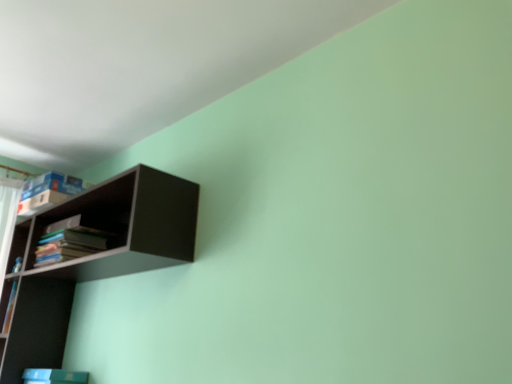
This screenshot has width=512, height=384. Describe the element at coordinates (69, 242) in the screenshot. I see `hardcover books at left` at that location.

At what (x,y) coordinates should I click in order to perform the action: click on hardcover books at left. Please return your answer as a coordinate pair (x, y). Looking at the image, I should click on (69, 242).

What do you see at coordinates (95, 256) in the screenshot?
I see `matte black shelf at upper left` at bounding box center [95, 256].

You are a GUI agent. You are given a task and a screenshot of the screen. Output one action in this format:
    pyautogui.click(x=<x>, y=<y>)
    Task: Click on the matte black shelf at upper left
    This screenshot has width=512, height=384.
    Given the screenshot: What is the action you would take?
    pyautogui.click(x=95, y=256)

Identify the location of hardcover books at left. (69, 242).

From the picture: Which object is positioned more to the right, hardcover books at left or matte black shelf at upper left?

matte black shelf at upper left is more to the right.

Is hardcover books at left in front of or behind matte black shelf at upper left in the image?

hardcover books at left is behind matte black shelf at upper left.

Consider the image. Which point is more distant from viewer, (47, 237) or (117, 239)?

Positioned behind is point (47, 237).

From the image's perspective, does hardcover books at left appear higher than matte black shelf at upper left?

Yes, from the image's perspective, hardcover books at left is on top of matte black shelf at upper left.

From a real-world perspective, is hardcover books at left below matte black shelf at upper left?

No, from a real-world perspective, hardcover books at left is not beneath matte black shelf at upper left.

Can you confirm if hardcover books at left is wider than matte black shelf at upper left?

In fact, hardcover books at left might be narrower than matte black shelf at upper left.

From their relative heights in the image, would you say hardcover books at left is taller or shorter than matte black shelf at upper left?

Clearly, hardcover books at left is shorter compared to matte black shelf at upper left.

Is hardcover books at left smaller than matte black shelf at upper left?

Yes.

Is matte black shelf at upper left surrounded by hardcover books at left?

No, matte black shelf at upper left is located outside of hardcover books at left.

Would you say hardcover books at left is a long distance from matte black shelf at upper left?

No, hardcover books at left is in close proximity to matte black shelf at upper left.

Is hardcover books at left oriented towards matte black shelf at upper left?

Yes, hardcover books at left is oriented towards matte black shelf at upper left.

How distant is hardcover books at left from matte black shelf at upper left?

A distance of 7.53 inches exists between hardcover books at left and matte black shelf at upper left.

At what (x,y) coordinates should I click in order to perform the action: click on shelf to the right of hardcover books at left. Please return your answer as a coordinate pair (x, y). This screenshot has width=512, height=384. Looking at the image, I should click on (95, 256).

Can you confirm if matte black shelf at upper left is positioned to the right of hardcover books at left?

Yes, matte black shelf at upper left is to the right of hardcover books at left.

Does matte black shelf at upper left come in front of hardcover books at left?

Yes.

Is point (30, 251) in front of point (70, 238)?

No, it is behind (70, 238).

From the image's perspective, would you say matte black shelf at upper left is positioned over hardcover books at left?

No, from the image's perspective, matte black shelf at upper left is not on top of hardcover books at left.

Consider the image. From a real-world perspective, is matte black shelf at upper left physically located above or below hardcover books at left?

From a real-world perspective, matte black shelf at upper left is physically below hardcover books at left.

Based on the photo, between matte black shelf at upper left and hardcover books at left, which one has larger width?

matte black shelf at upper left.

Who is shorter, matte black shelf at upper left or hardcover books at left?

hardcover books at left is shorter.

Based on their sizes in the image, would you say matte black shelf at upper left is bigger or smaller than hardcover books at left?

Considering their sizes, matte black shelf at upper left takes up more space than hardcover books at left.

Is matte black shelf at upper left situated inside hardcover books at left or outside?

matte black shelf at upper left is not enclosed by hardcover books at left.

Is matte black shelf at upper left directly adjacent to hardcover books at left?

No, matte black shelf at upper left is not with hardcover books at left.

Is matte black shelf at upper left oriented away from hardcover books at left?

Absolutely, matte black shelf at upper left is directed away from hardcover books at left.

What's the angular difference between matte black shelf at upper left and hardcover books at left's facing directions?

There is a 0.703-degree angle between the facing directions of matte black shelf at upper left and hardcover books at left.

The image size is (512, 384). I want to click on book that appears on the left of matte black shelf at upper left, so (69, 242).

Locate an element on the screen. The width and height of the screenshot is (512, 384). book behind the matte black shelf at upper left is located at coordinates (69, 242).

Identify the location of shelf below the hardcover books at left (from the image's perspective). Image resolution: width=512 pixels, height=384 pixels. (95, 256).